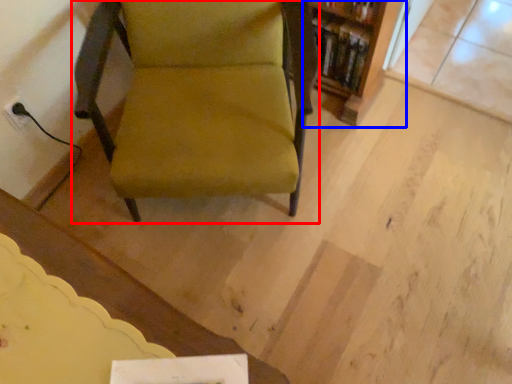
Question: Among these objects, which one is nearest to the camera, chair (highlighted by a red box) or shelf (highlighted by a blue box)?

Choices:
 (A) chair
 (B) shelf

Answer: (A)